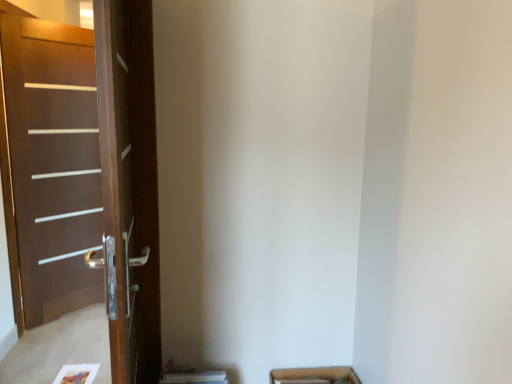
Question: Is brown wooden screen door at left completely or partially outside of brown wood door at left?

Choices:
 (A) yes
 (B) no

Answer: (A)

Question: Is the surface of brown wooden screen door at left in direct contact with brown wood door at left?

Choices:
 (A) no
 (B) yes

Answer: (A)

Question: From a real-world perspective, is brown wooden screen door at left beneath brown wood door at left?

Choices:
 (A) no
 (B) yes

Answer: (A)

Question: Is brown wooden screen door at left smaller than brown wood door at left?

Choices:
 (A) no
 (B) yes

Answer: (A)

Question: Does brown wooden screen door at left have a larger size compared to brown wood door at left?

Choices:
 (A) no
 (B) yes

Answer: (B)

Question: Is brown wooden screen door at left positioned before brown wood door at left?

Choices:
 (A) yes
 (B) no

Answer: (A)

Question: Is brown wood door at left positioned with its back to brown wooden screen door at left?

Choices:
 (A) yes
 (B) no

Answer: (B)

Question: Can you confirm if brown wood door at left is smaller than brown wooden screen door at left?

Choices:
 (A) no
 (B) yes

Answer: (B)

Question: Considering the relative positions of brown wood door at left and brown wooden screen door at left in the image provided, is brown wood door at left in front of brown wooden screen door at left?

Choices:
 (A) yes
 (B) no

Answer: (B)

Question: Would you say brown wood door at left is outside brown wooden screen door at left?

Choices:
 (A) no
 (B) yes

Answer: (B)

Question: Is brown wooden screen door at left a part of brown wood door at left?

Choices:
 (A) yes
 (B) no

Answer: (B)

Question: Can you confirm if brown wood door at left is thinner than brown wooden screen door at left?

Choices:
 (A) no
 (B) yes

Answer: (B)

Question: Visually, is brown wooden screen door at left positioned to the left or to the right of brown wood door at left?

Choices:
 (A) right
 (B) left

Answer: (A)